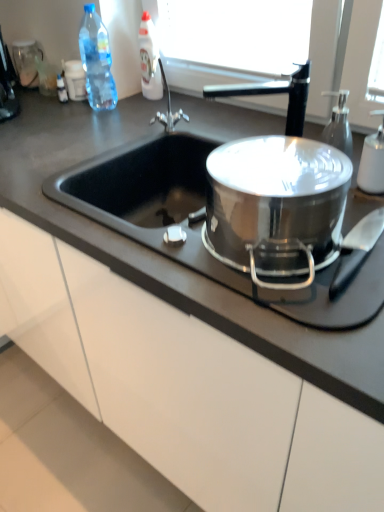
This screenshot has height=512, width=384. Describe the element at coordinates (372, 160) in the screenshot. I see `white matte soap dispenser at right, marked as the first bottle in a right-to-left arrangement` at that location.

In order to face white glossy bottle at upper center, the second bottle viewed from the right, should I rotate leftwards or rightwards?

To align with it, rotate left about 5.640°.

This screenshot has width=384, height=512. Find the location of `transparent plastic bottle at upper left, which is the 3th bottle in right-to-left order`. transparent plastic bottle at upper left, which is the 3th bottle in right-to-left order is located at coordinates (97, 61).

What is the approximate height of transparent plastic bottle at upper left, arranged as the first bottle when viewed from the left?

transparent plastic bottle at upper left, arranged as the first bottle when viewed from the left, is 12.35 inches tall.

This screenshot has height=512, width=384. What do you see at coordinates (7, 84) in the screenshot?
I see `black plastic coffee machine at upper left` at bounding box center [7, 84].

Where is `white matte soap dispenser at right, which is the third bottle from left to right`? white matte soap dispenser at right, which is the third bottle from left to right is located at coordinates (372, 160).

Is black matte countertop at center turned away from white matte soap dispenser at right, the third bottle viewed from the back?

No, white matte soap dispenser at right, the third bottle viewed from the back, is not at the back of black matte countertop at center.

From the image's perspective, is black matte countertop at center beneath white matte soap dispenser at right, marked as the first bottle in a right-to-left arrangement?

Correct, black matte countertop at center appears lower than white matte soap dispenser at right, marked as the first bottle in a right-to-left arrangement, in the image.

Is black matte countertop at center spatially inside white matte soap dispenser at right, which ranks as the 3th bottle in top-to-bottom order, or outside of it?

black matte countertop at center cannot be found inside white matte soap dispenser at right, which ranks as the 3th bottle in top-to-bottom order.

From the image's perspective, is transparent plastic bottle at upper left, the second bottle from the bottom, above or below transparent glass soap dispenser at upper right?

Clearly, from the image's perspective, transparent plastic bottle at upper left, the second bottle from the bottom, is above transparent glass soap dispenser at upper right.

Considering the relative positions of transparent plastic bottle at upper left, placed as the 2th bottle when sorted from back to front, and transparent glass soap dispenser at upper right in the image provided, is transparent plastic bottle at upper left, placed as the 2th bottle when sorted from back to front, to the right of transparent glass soap dispenser at upper right from the viewer's perspective?

Incorrect, transparent plastic bottle at upper left, placed as the 2th bottle when sorted from back to front, is not on the right side of transparent glass soap dispenser at upper right.

Which point is more distant from viewer, (96,58) or (334,137)?

The point (96,58) is behind.

From a real-world perspective, is transparent plastic bottle at upper left, which is the 3th bottle in right-to-left order, physically below transparent glass soap dispenser at upper right?

No, from a real-world perspective, transparent plastic bottle at upper left, which is the 3th bottle in right-to-left order, is not beneath transparent glass soap dispenser at upper right.

How far apart are transparent plastic bottle at upper left, placed as the 2th bottle when sorted from back to front, and stainless steel pot at center?

The distance of transparent plastic bottle at upper left, placed as the 2th bottle when sorted from back to front, from stainless steel pot at center is 3.28 feet.

From the image's perspective, is transparent plastic bottle at upper left, arranged as the first bottle when viewed from the left, over stainless steel pot at center?

Correct, transparent plastic bottle at upper left, arranged as the first bottle when viewed from the left, appears higher than stainless steel pot at center in the image.

Is transparent plastic bottle at upper left, placed as the 2th bottle when sorted from back to front, wider than stainless steel pot at center?

In fact, transparent plastic bottle at upper left, placed as the 2th bottle when sorted from back to front, might be narrower than stainless steel pot at center.

Is point (98, 87) less distant than point (381, 248)?

No.

Is black plastic coffee machine at upper left wider or thinner than transparent glass soap dispenser at upper right?

In the image, black plastic coffee machine at upper left appears to be wider than transparent glass soap dispenser at upper right.

Considering the relative positions of black plastic coffee machine at upper left and transparent glass soap dispenser at upper right in the image provided, is black plastic coffee machine at upper left to the left of transparent glass soap dispenser at upper right from the viewer's perspective?

Yes, black plastic coffee machine at upper left is to the left of transparent glass soap dispenser at upper right.

Is black plastic coffee machine at upper left not within transparent glass soap dispenser at upper right?

Yes, black plastic coffee machine at upper left is outside of transparent glass soap dispenser at upper right.

Where is `soap dispenser that is above the black plastic coffee machine at upper left (from a real-world perspective)`? Image resolution: width=384 pixels, height=512 pixels. soap dispenser that is above the black plastic coffee machine at upper left (from a real-world perspective) is located at coordinates (338, 124).

Image resolution: width=384 pixels, height=512 pixels. I want to click on coffee machine that appears behind the stainless steel pot at center, so click(x=7, y=84).

Is black plastic coffee machine at upper left bigger or smaller than stainless steel pot at center?

Considering their sizes, black plastic coffee machine at upper left takes up less space than stainless steel pot at center.

From a real-world perspective, is black plastic coffee machine at upper left below stainless steel pot at center?

No, from a real-world perspective, black plastic coffee machine at upper left is not under stainless steel pot at center.

How much distance is there between black plastic coffee machine at upper left and stainless steel pot at center?

black plastic coffee machine at upper left and stainless steel pot at center are 3.54 feet apart from each other.

From a real-world perspective, which is physically below, black plastic coffee machine at upper left or black matte countertop at center?

From a 3D spatial view, black matte countertop at center is below.

Where is `countertop in front of the black plastic coffee machine at upper left`? The width and height of the screenshot is (384, 512). countertop in front of the black plastic coffee machine at upper left is located at coordinates (166, 258).

How distant is black plastic coffee machine at upper left from black matte countertop at center?

black plastic coffee machine at upper left is 18.20 inches from black matte countertop at center.

How many degrees apart are the facing directions of black plastic coffee machine at upper left and black matte countertop at center?

The angular difference between black plastic coffee machine at upper left and black matte countertop at center is 28.4 degrees.

Between white glossy bottle at upper center, which is counted as the third bottle, starting from the front, and black matte countertop at center, which one appears on the right side from the viewer's perspective?

black matte countertop at center is more to the right.

Is white glossy bottle at upper center, the 3th bottle in the bottom-to-top sequence, thinner than black matte countertop at center?

Yes.

From a real-world perspective, which is physically above, white glossy bottle at upper center, which is counted as the third bottle, starting from the front, or black matte countertop at center?

white glossy bottle at upper center, which is counted as the third bottle, starting from the front, is physically above.

Where is `the 1st bottle behind the black matte countertop at center, starting your count from the anchor`? the 1st bottle behind the black matte countertop at center, starting your count from the anchor is located at coordinates (372, 160).

Identify the location of soap dispenser that is below the transparent plastic bottle at upper left, placed as the 2th bottle when sorted from back to front (from the image's perspective). This screenshot has width=384, height=512. (338, 124).

Based on their spatial positions, is black matte countertop at center or transparent glass soap dispenser at upper right further from black plastic coffee machine at upper left?

transparent glass soap dispenser at upper right is further to black plastic coffee machine at upper left.

When comparing their distances from transparent glass soap dispenser at upper right, does transparent plastic bottle at upper left, arranged as the first bottle when viewed from the left, or black plastic coffee machine at upper left seem further?

black plastic coffee machine at upper left is positioned further to the anchor transparent glass soap dispenser at upper right.

Considering their positions, is white glossy bottle at upper center, the second bottle from the left, positioned closer to stainless steel pot at center than transparent glass soap dispenser at upper right?

transparent glass soap dispenser at upper right lies closer to stainless steel pot at center than the other object.

Based on their spatial positions, is stainless steel pot at center or white glossy bottle at upper center, the second bottle from the left, closer to white matte soap dispenser at right, the first bottle positioned from the front?

stainless steel pot at center lies closer to white matte soap dispenser at right, the first bottle positioned from the front, than the other object.

Looking at the image, which one is located closer to white glossy bottle at upper center, the second bottle from the left, stainless steel pot at center or transparent plastic bottle at upper left, arranged as the first bottle when viewed from the left?

transparent plastic bottle at upper left, arranged as the first bottle when viewed from the left, is closer to white glossy bottle at upper center, the second bottle from the left.

Looking at the image, which one is located further to stainless steel pot at center, black plastic coffee machine at upper left or transparent glass soap dispenser at upper right?

Among the two, black plastic coffee machine at upper left is located further to stainless steel pot at center.

From the image, which object appears to be nearer to black matte countertop at center, white glossy bottle at upper center, the 1th bottle from the top, or transparent plastic bottle at upper left, which is the 3th bottle in right-to-left order?

Among the two, transparent plastic bottle at upper left, which is the 3th bottle in right-to-left order, is located nearer to black matte countertop at center.

When comparing their distances from white glossy bottle at upper center, which is counted as the third bottle, starting from the front, does stainless steel pot at center or transparent glass soap dispenser at upper right seem further?

Among the two, stainless steel pot at center is located further to white glossy bottle at upper center, which is counted as the third bottle, starting from the front.

Locate an element on the screen. Image resolution: width=384 pixels, height=512 pixels. gas stove between black plastic coffee machine at upper left and transparent glass soap dispenser at upper right is located at coordinates (324, 281).

The height and width of the screenshot is (512, 384). What are the coordinates of `bottle between black plastic coffee machine at upper left and white glossy bottle at upper center, the second bottle from the left, in the horizontal direction` in the screenshot? It's located at (97, 61).

Where is `coffee machine located between stainless steel pot at center and white glossy bottle at upper center, the 3th bottle in the bottom-to-top sequence, in the depth direction`? coffee machine located between stainless steel pot at center and white glossy bottle at upper center, the 3th bottle in the bottom-to-top sequence, in the depth direction is located at coordinates (7, 84).

Where is `soap dispenser between stainless steel pot at center and transparent plastic bottle at upper left, the 2th bottle positioned from the top, in the front-back direction`? soap dispenser between stainless steel pot at center and transparent plastic bottle at upper left, the 2th bottle positioned from the top, in the front-back direction is located at coordinates (338, 124).